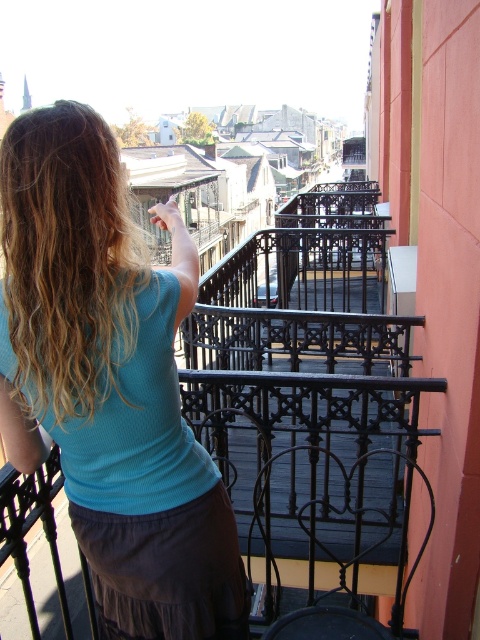
You are a fashion designer observing the person on the balcony. You need to determine which item, the teal ribbed tank top at upper left or the blonde wavy hair at upper left, has a greater horizontal span from left to right in the image. Based on the description, which one is wider?

The teal ribbed tank top at upper left might be wider than blonde wavy hair at upper left, so the teal ribbed tank top at upper left is likely wider.

You are a fashion designer observing a person on a balcony. You notice the teal ribbed tank top at upper left and the blonde wavy hair at upper left. Which of these two items is positioned higher on the person?

The teal ribbed tank top at upper left is taller than blonde wavy hair at upper left, so the teal ribbed tank top at upper left is positioned higher on the person.